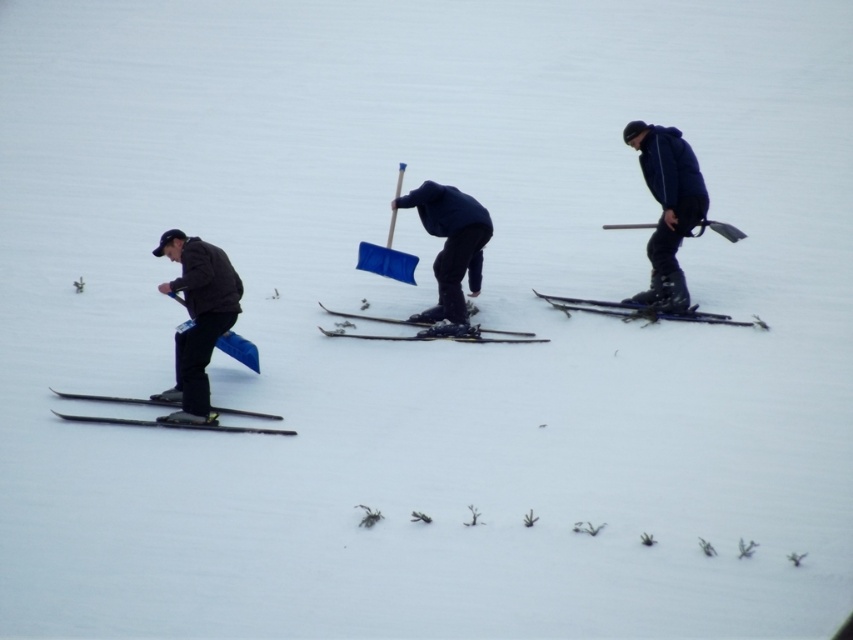
Question: Which of the following is the closest to the observer?

Choices:
 (A) dark blue jacket at right
 (B) matte black ski at center
 (C) black matte skis at left

Answer: (C)

Question: Is black matte skis at left closer to the viewer compared to matte black skis at center?

Choices:
 (A) no
 (B) yes

Answer: (B)

Question: Can you confirm if dark blue jacket at right is wider than shiny black skis at right?

Choices:
 (A) no
 (B) yes

Answer: (A)

Question: Which point is closer to the camera taking this photo?

Choices:
 (A) (192, 355)
 (B) (508, 339)

Answer: (A)

Question: Which of the following is the closest to the observer?

Choices:
 (A) (201, 260)
 (B) (381, 337)

Answer: (A)

Question: Is blue plastic shovel at center closer to camera compared to shiny black skis at right?

Choices:
 (A) no
 (B) yes

Answer: (B)